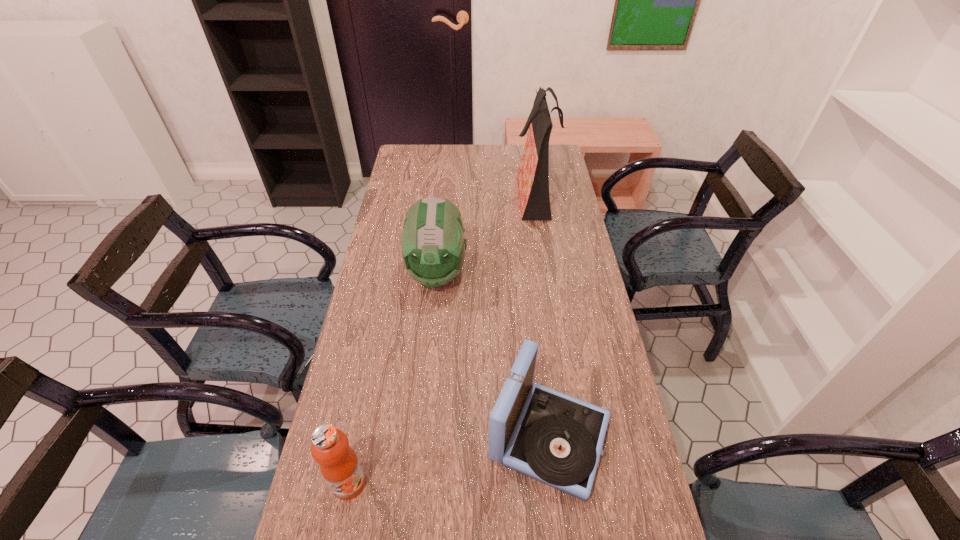
This screenshot has width=960, height=540. In order to click on empty space that is in between the fruit juice and the farthest object in this screenshot , I will do `click(442, 339)`.

I want to click on object that is the third closest to the shopping bag, so click(339, 465).

At what (x,y) coordinates should I click in order to perform the action: click on object that is the second closest to the football helmet. Please return your answer as a coordinate pair (x, y). Looking at the image, I should click on (556, 439).

Locate an element on the screen. This screenshot has height=540, width=960. free space that satisfies the following two spatial constraints: 1. on the front side of the farthest object; 2. on the front label of the fruit juice is located at coordinates (579, 483).

Find the location of a particular element. Image resolution: width=960 pixels, height=540 pixels. vacant space that satisfies the following two spatial constraints: 1. on the front side of the shopping bag; 2. on the visor of the football helmet is located at coordinates (546, 273).

This screenshot has width=960, height=540. I want to click on vacant space that satisfies the following two spatial constraints: 1. on the front side of the farthest object; 2. on the front label of the fruit juice, so click(x=579, y=483).

Where is `vacant space that satisfies the following two spatial constraints: 1. on the visor of the phonograph record; 2. on the left side of the third nearest object`? This screenshot has width=960, height=540. vacant space that satisfies the following two spatial constraints: 1. on the visor of the phonograph record; 2. on the left side of the third nearest object is located at coordinates (420, 438).